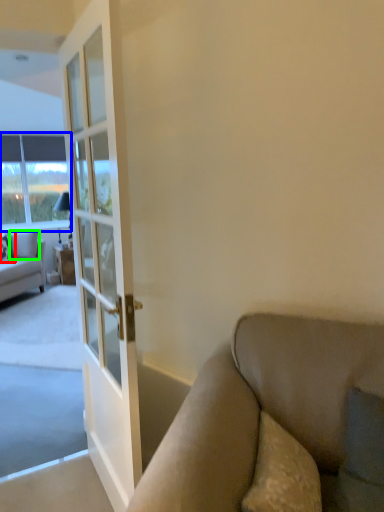
Question: Which is farther away from pillow (highlighted by a red box)? window (highlighted by a blue box) or pillow (highlighted by a green box)?

Choices:
 (A) window
 (B) pillow

Answer: (A)